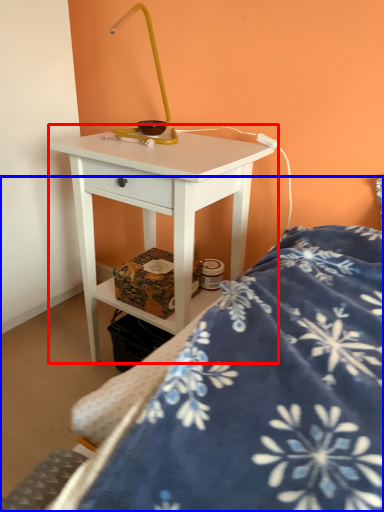
Question: Which point is further to the camera, nightstand (highlighted by a red box) or bed (highlighted by a blue box)?

Choices:
 (A) nightstand
 (B) bed

Answer: (A)